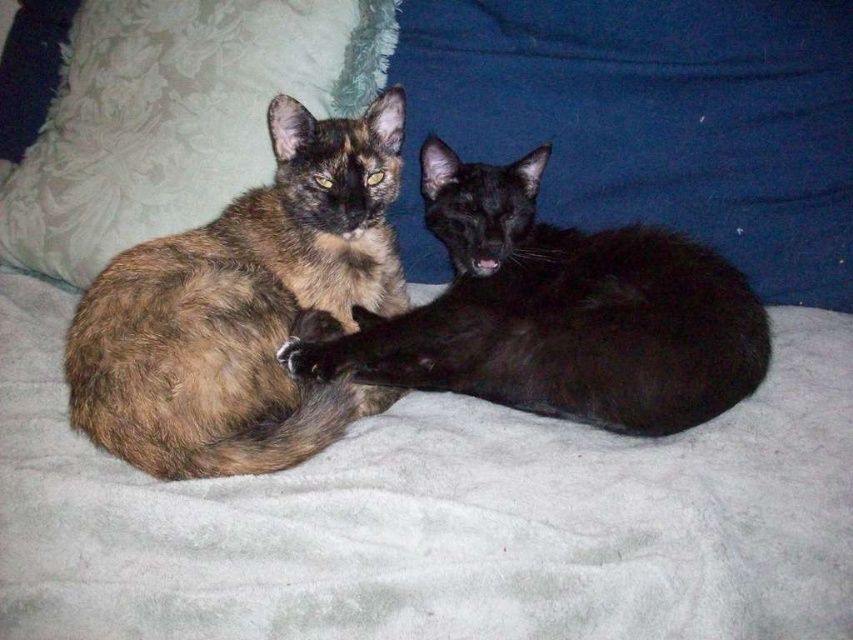
You are a cat owner trying to fit both cats onto a 1.2 meter wide cat bed. Given that the tortoiseshell fur cat at left is smaller than the brown tortoiseshell cat at center, will they both fit comfortably if placed side by side?

The tortoiseshell fur cat at left has a lesser width compared to the brown tortoiseshell cat at center. Assuming their combined widths are less than 1.2 meters, they should fit comfortably side by side on the cat bed.

You are a cat owner who wants to place a new toy between the blue fabric pillow at upper center and the brown tortoiseshell cat at center. The toy is 20 centimeters long. Will the toy fit between them?

The blue fabric pillow at upper center is 17.88 centimeters away from the brown tortoiseshell cat at center. Since the toy is 20 centimeters long, it will not fit between them as the distance is shorter than the toy.

You are a cat owner trying to place a new toy between the blue fabric pillow at upper center and the tortoiseshell fur cat at left. Which object should you move closer to you to create space?

The blue fabric pillow at upper center is closer to you than the tortoiseshell fur cat at left. To create space, move the blue fabric pillow at upper center away from you since it is already closer and moving it would free up space between them.